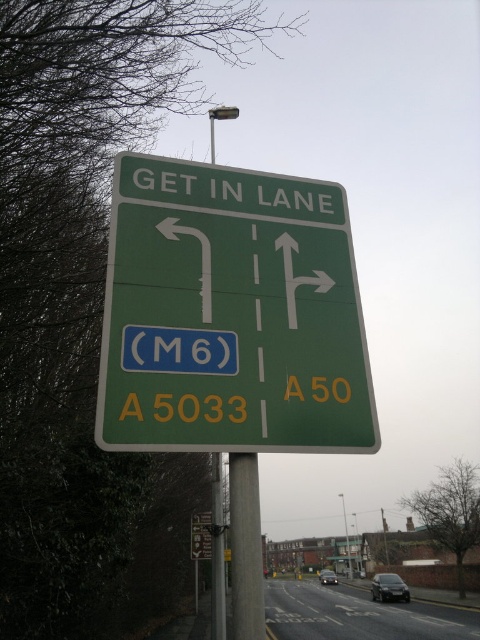
Question: Is the position of green matte sign at center less distant than that of metallic pole at center?

Choices:
 (A) no
 (B) yes

Answer: (B)

Question: Is green matte sign at center positioned behind metallic pole at center?

Choices:
 (A) no
 (B) yes

Answer: (A)

Question: Is green matte sign at center wider than metallic pole at center?

Choices:
 (A) no
 (B) yes

Answer: (B)

Question: Which object is closer to the camera taking this photo?

Choices:
 (A) green matte sign at center
 (B) metallic pole at center

Answer: (A)

Question: Which object is farther from the camera taking this photo?

Choices:
 (A) green matte sign at center
 (B) metallic pole at center

Answer: (B)